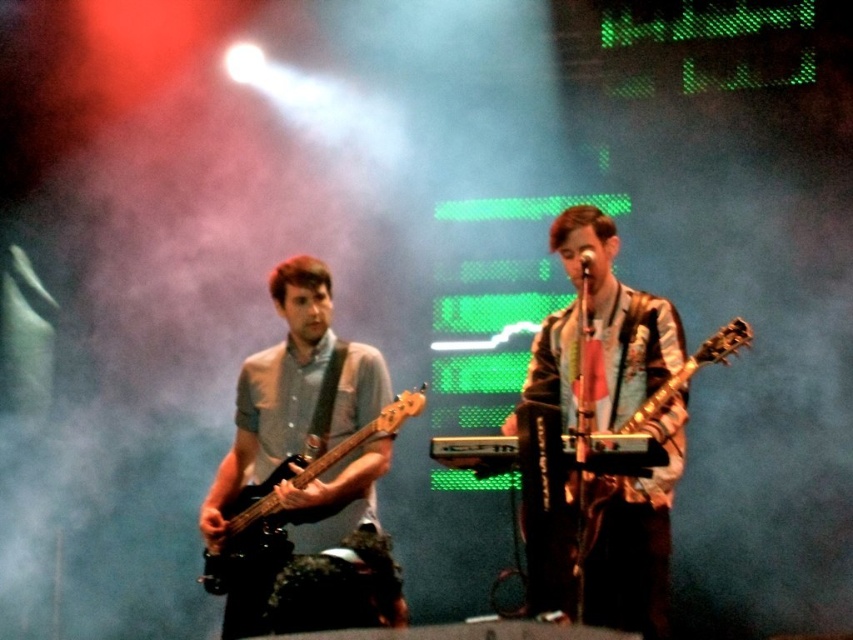
Does shiny silver guitar at center appear on the left side of matte black bass guitar at left?

No, shiny silver guitar at center is not to the left of matte black bass guitar at left.

The image size is (853, 640). What are the coordinates of `shiny silver guitar at center` in the screenshot? It's located at (616, 320).

Locate an element on the screen. The height and width of the screenshot is (640, 853). shiny silver guitar at center is located at coordinates (616, 320).